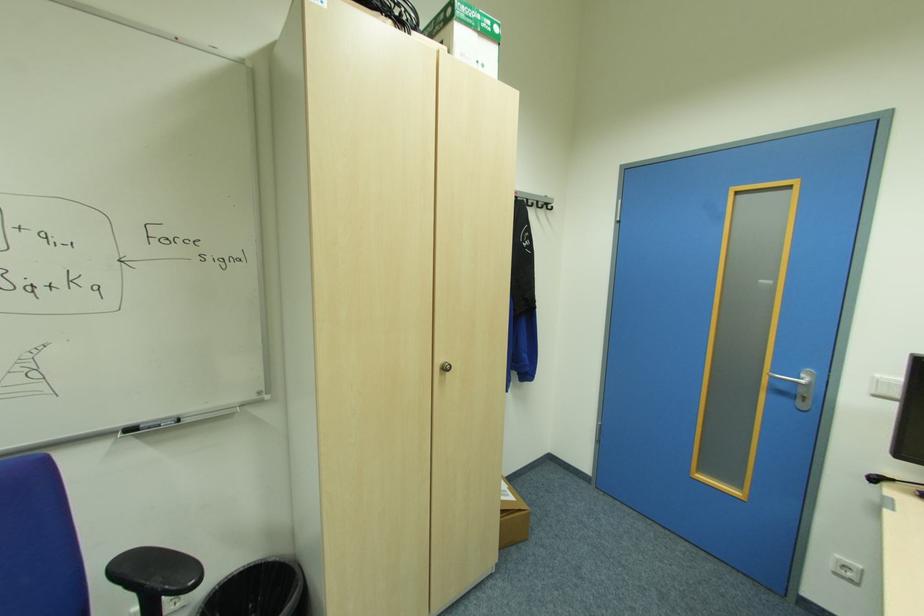
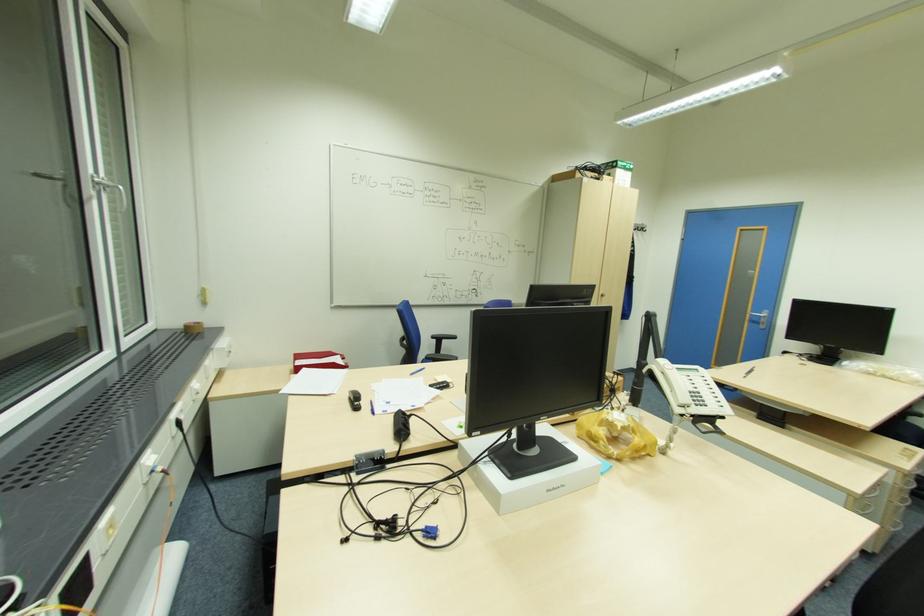
The images are taken continuously from a first-person perspective. In which direction are you moving?

The cameraman moved toward left, backward.